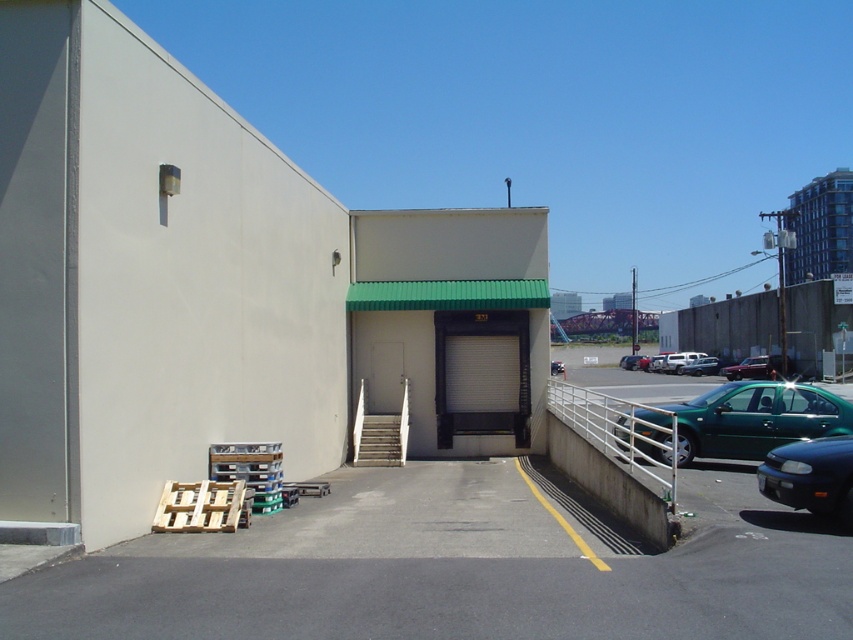
In the scene shown: Can you confirm if green matte sedan at right is positioned to the left of green matte sedan at center?

Correct, you'll find green matte sedan at right to the left of green matte sedan at center.

Between point (810, 417) and point (558, 371), which one is positioned in front?

Point (810, 417) is in front.

Which is in front, point (688, 444) or point (555, 369)?

Point (688, 444) is in front.

You are a GUI agent. You are given a task and a screenshot of the screen. Output one action in this format:
    pyautogui.click(x=<x>, y=<y>)
    Task: Click on the green matte sedan at right
    
    Given the screenshot: What is the action you would take?
    pyautogui.click(x=755, y=419)

Is green matte car at lower right to the right of metallic silver sedan at center from the viewer's perspective?

Incorrect, green matte car at lower right is not on the right side of metallic silver sedan at center.

Which is more to the left, green matte car at lower right or metallic silver sedan at center?

green matte car at lower right

Is point (602, 426) behind point (712, 372)?

No, it is not.

Identify the location of green matte car at lower right. The image size is (853, 640). click(694, 420).

Who is more distant from viewer, (607, 419) or (790, 424)?

The point (607, 419) is behind.

Identify the location of green matte car at lower right. (694, 420).

Locate an element on the screen. green matte car at lower right is located at coordinates (694, 420).